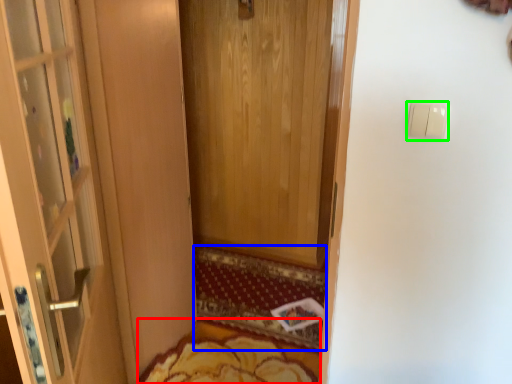
Question: Which object is positioned closest to mat (highlighted by a red box)? Select from doormat (highlighted by a blue box) and light switch (highlighted by a green box).

Choices:
 (A) doormat
 (B) light switch

Answer: (A)